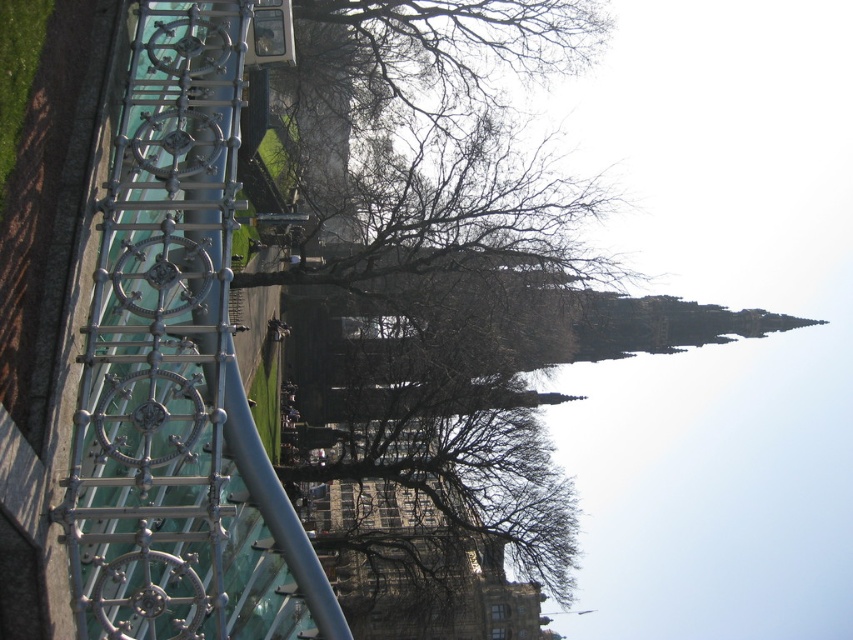
Can you confirm if metallic polished rail at left is thinner than brown leafless tree at center?

Yes.

Is metallic polished rail at left bigger than brown leafless tree at center?

No.

Who is more forward, (161, 202) or (405, 170)?

Point (161, 202)

Find the location of `metallic polished rail at left`. metallic polished rail at left is located at coordinates (178, 365).